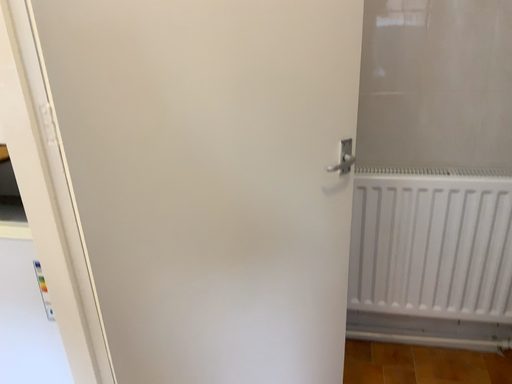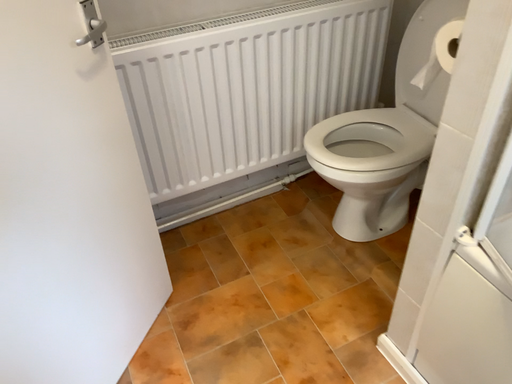
Question: How did the camera likely rotate when shooting the video?

Choices:
 (A) rotated upward
 (B) rotated downward

Answer: (B)